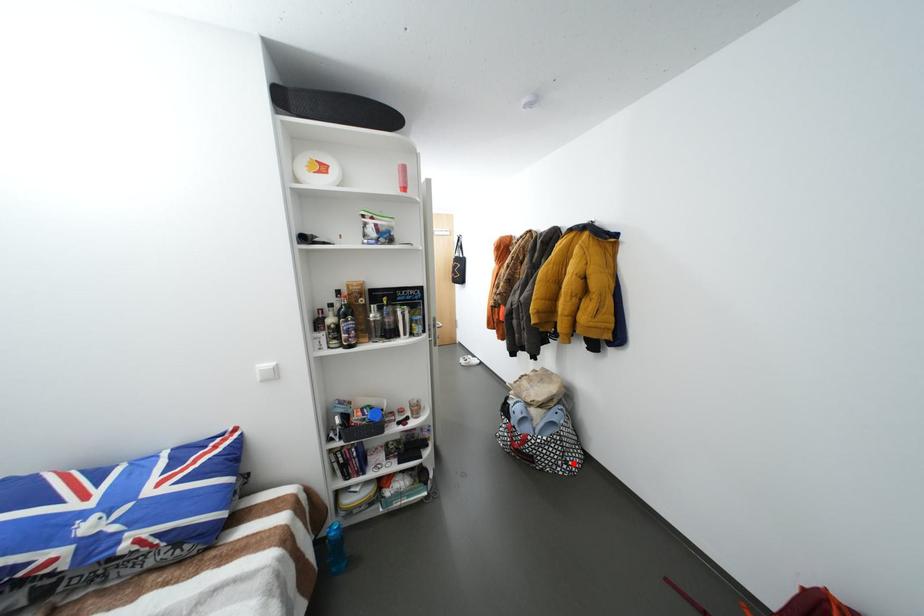
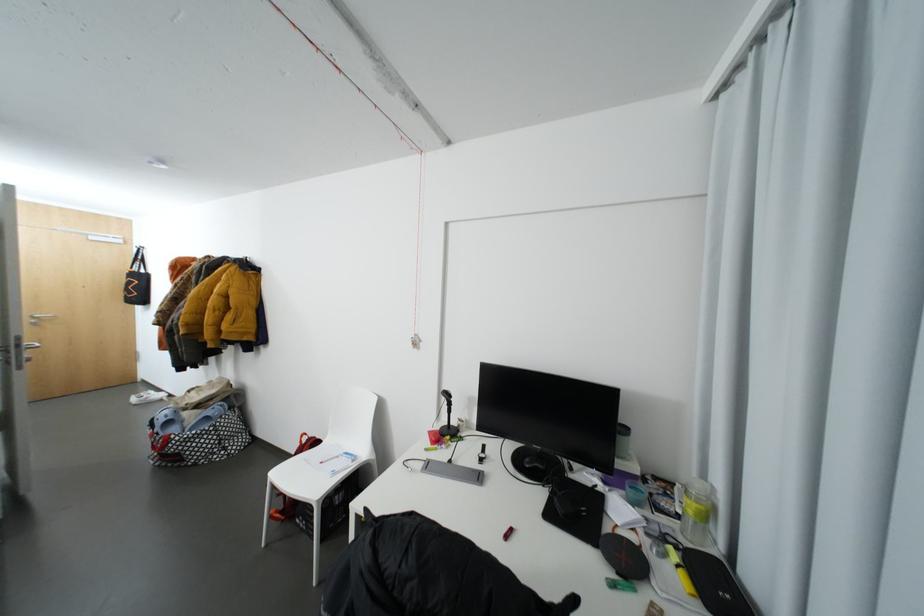
Question: I am providing you with two images of the same scene from different viewpoints. A red point is shown in image1. For the corresponding object point in image2, is it positioned nearer or farther from the camera?

Choices:
 (A) Nearer
 (B) Farther

Answer: (A)